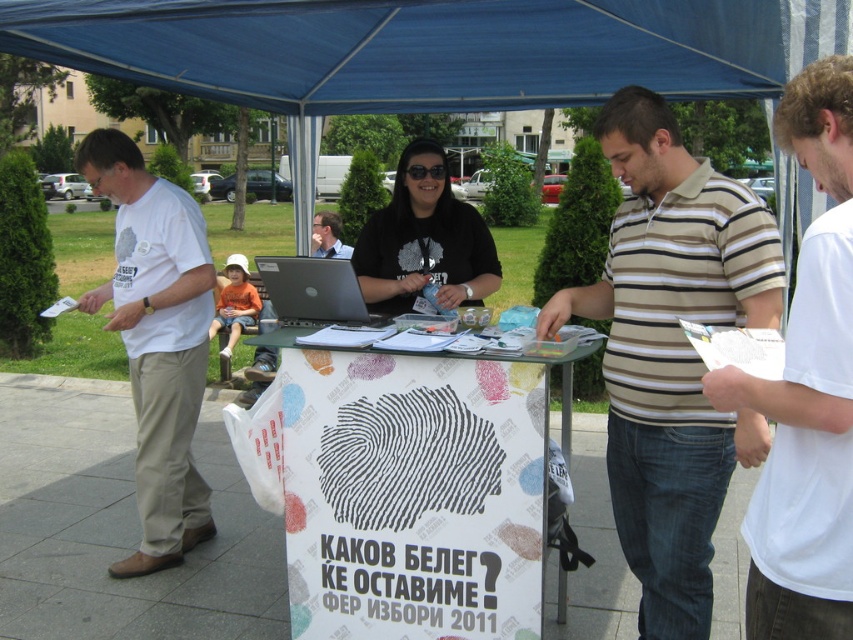
You are setting up for an event and need to place a matte black laptop at center on the white plastic table at center. However, you notice that the laptop is currently 4.52 meters away from the table. Can you safely move it to the table without any obstacles?

The distance between the white plastic table at center and the matte black laptop at center is 4.52 meters. Since there are no obstacles mentioned in the scene description, you can safely move the laptop to the table.

You are standing in front of the table at the event. There are two points marked on the poster. One is at coordinates point (x=846, y=280) and the other is at point (x=375, y=317). Which point is closer to you?

Point (x=846, y=280) is closer to the viewer than point (x=375, y=317).

You are a photographer standing at the event. You want to take a photo of the blue fabric canopy at upper center without any obstructions. The camera you are using has a minimum focusing distance of 3 meters. Can you take the photo from your current position?

The blue fabric canopy at upper center is 2.82 meters away from camera, which is closer than the camera minimum focusing distance of 3 meters. Therefore, you cannot take the photo from your current position without moving closer or farther away.